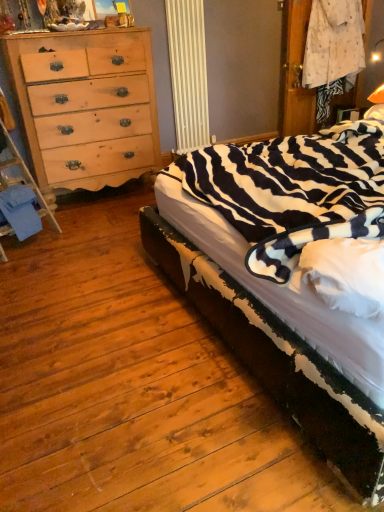
Question: In the image, is zebra-patterned fabric at right on the left side or the right side of natural wood dresser at left?

Choices:
 (A) left
 (B) right

Answer: (B)

Question: Is point (380, 476) closer or farther from the camera than point (59, 151)?

Choices:
 (A) farther
 (B) closer

Answer: (B)

Question: Considering the real-world distances, which object is farthest from the natural wood dresser at left?

Choices:
 (A) blue fabric at lower left
 (B) zebra-patterned fabric at right

Answer: (B)

Question: Which object is the farthest from the natural wood dresser at left?

Choices:
 (A) blue fabric at lower left
 (B) zebra-patterned fabric at right

Answer: (B)